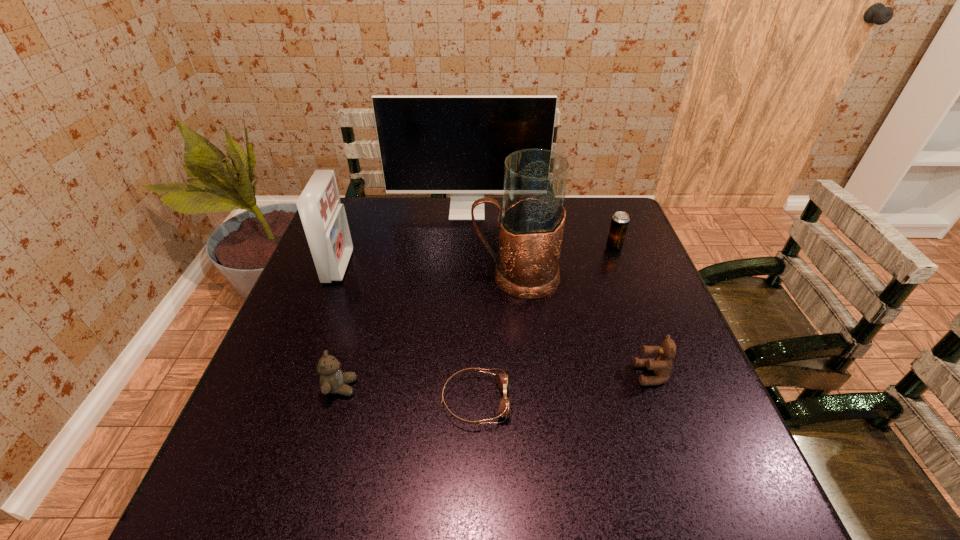
Image resolution: width=960 pixels, height=540 pixels. In order to click on the first-aid kit at the left edge in this screenshot , I will do `click(323, 217)`.

Find the location of a particular element. This screenshot has width=960, height=540. teddy bear at the left edge is located at coordinates (332, 379).

Where is `beer can at the right edge`? This screenshot has width=960, height=540. beer can at the right edge is located at coordinates (620, 220).

The image size is (960, 540). I want to click on teddy bear located at the right edge, so click(662, 364).

Find the location of `free region at the far edge of the desktop`. free region at the far edge of the desktop is located at coordinates (378, 234).

Where is `vacant space at the near edge of the desktop`? Image resolution: width=960 pixels, height=540 pixels. vacant space at the near edge of the desktop is located at coordinates (601, 504).

Image resolution: width=960 pixels, height=540 pixels. Identify the location of vacant space at the left edge. (291, 427).

Where is `free region at the right edge of the desktop`? The image size is (960, 540). free region at the right edge of the desktop is located at coordinates (614, 260).

In the image, there is a desktop. Identify the location of vacant space at the far left corner. Image resolution: width=960 pixels, height=540 pixels. (379, 213).

In the image, there is a desktop. Identify the location of free space at the near left corner. The width and height of the screenshot is (960, 540). (244, 511).